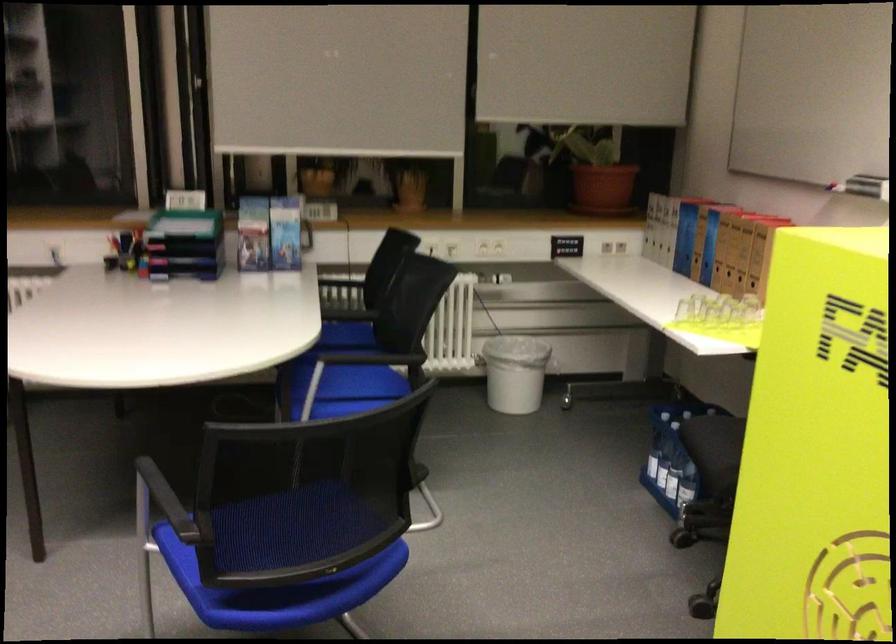
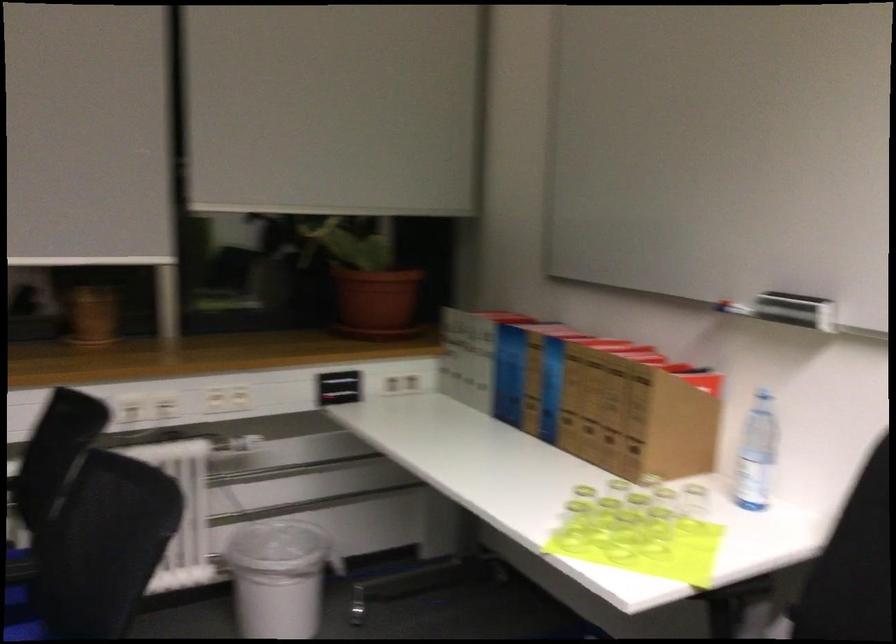
The point at (515, 365) is marked in the first image. Where is the corresponding point in the second image?

(278, 576)